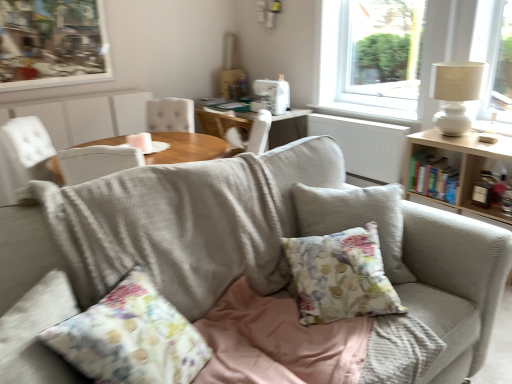
Image resolution: width=512 pixels, height=384 pixels. I want to click on free space above white textured radiator at center (from a real-world perspective), so click(x=359, y=115).